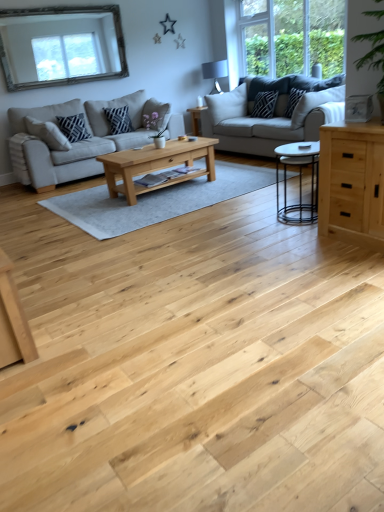
The height and width of the screenshot is (512, 384). I want to click on light gray fabric couch at left, marked as the first studio couch in a left-to-right arrangement, so click(80, 141).

The image size is (384, 512). What do you see at coordinates (80, 141) in the screenshot? I see `light gray fabric couch at left, the second studio couch when ordered from right to left` at bounding box center [80, 141].

This screenshot has width=384, height=512. What do you see at coordinates (61, 46) in the screenshot?
I see `silver-framed mirror at upper left` at bounding box center [61, 46].

Locate an element on the screen. The height and width of the screenshot is (512, 384). silver-framed mirror at upper left is located at coordinates (61, 46).

What is the approximate height of light gray fabric couch at center, which appears as the second studio couch when viewed from the left?

38.28 inches.

At what (x,y) coordinates should I click in order to perform the action: click on black metal coffee table at center, which is the first coffee table from front to back. Please return your answer as a coordinate pair (x, y). Looking at the image, I should click on (300, 181).

Describe the element at coordinates (352, 182) in the screenshot. This screenshot has width=384, height=512. I see `natural wood chest of drawers at right` at that location.

The width and height of the screenshot is (384, 512). Describe the element at coordinates (118, 120) in the screenshot. I see `matte black pillow at center-left, which ranks as the second pillow in left-to-right order` at that location.

This screenshot has height=512, width=384. What are the coordinates of `light gray fabric couch at left, the second studio couch when ordered from right to left` in the screenshot? It's located at (80, 141).

Based on the photo, how many degrees apart are the facing directions of matte black lampshade at upper center and white textured pillow at upper right, which appears as the first pillow when viewed from the right?

matte black lampshade at upper center and white textured pillow at upper right, which appears as the first pillow when viewed from the right, are facing 43 degrees away from each other.

Measure the distance between matte black lampshade at upper center and white textured pillow at upper right, which appears as the first pillow when viewed from the right.

matte black lampshade at upper center and white textured pillow at upper right, which appears as the first pillow when viewed from the right, are 1.81 meters apart.

Can we say matte black lampshade at upper center lies outside white textured pillow at upper right, which appears as the first pillow when viewed from the right?

Yes, matte black lampshade at upper center is outside of white textured pillow at upper right, which appears as the first pillow when viewed from the right.

Which of these two, matte black lampshade at upper center or white textured pillow at upper right, marked as the fourth pillow in a left-to-right arrangement, stands taller?

matte black lampshade at upper center is taller.

Is silver-framed mirror at upper left not close to light gray fabric couch at left, marked as the first studio couch in a left-to-right arrangement?

silver-framed mirror at upper left is actually quite close to light gray fabric couch at left, marked as the first studio couch in a left-to-right arrangement.

From the image's perspective, is silver-framed mirror at upper left beneath light gray fabric couch at left, the second studio couch when ordered from right to left?

Incorrect, from the image's perspective, silver-framed mirror at upper left is higher than light gray fabric couch at left, the second studio couch when ordered from right to left.

From a real-world perspective, is silver-framed mirror at upper left physically located above or below light gray fabric couch at left, marked as the first studio couch in a left-to-right arrangement?

silver-framed mirror at upper left is above light gray fabric couch at left, marked as the first studio couch in a left-to-right arrangement.

Can you confirm if silver-framed mirror at upper left is taller than light gray fabric couch at left, marked as the first studio couch in a left-to-right arrangement?

No, silver-framed mirror at upper left is not taller than light gray fabric couch at left, marked as the first studio couch in a left-to-right arrangement.

Is clear glass window at upper right not near white textured pillow at upper right, marked as the fourth pillow in a left-to-right arrangement?

Absolutely, clear glass window at upper right is distant from white textured pillow at upper right, marked as the fourth pillow in a left-to-right arrangement.

Is point (246, 64) positioned in front of point (291, 108)?

That is False.

Can you confirm if clear glass window at upper right is taller than white textured pillow at upper right, marked as the fourth pillow in a left-to-right arrangement?

Correct, clear glass window at upper right is much taller as white textured pillow at upper right, marked as the fourth pillow in a left-to-right arrangement.

Would you say clear glass window at upper right is inside or outside white textured pillow at upper right, marked as the fourth pillow in a left-to-right arrangement?

The correct answer is: outside.

Is clear glass window at upper right positioned far away from silver-framed mirror at upper left?

Yes, clear glass window at upper right and silver-framed mirror at upper left are located far from each other.

Which object is further away from the camera taking this photo, clear glass window at upper right or silver-framed mirror at upper left?

silver-framed mirror at upper left is further away from the camera.

Based on the photo, from the image's perspective, who appears lower, clear glass window at upper right or silver-framed mirror at upper left?

silver-framed mirror at upper left.

Looking at this image, between clear glass window at upper right and silver-framed mirror at upper left, which one appears on the right side from the viewer's perspective?

clear glass window at upper right.

In the scene shown: Which of these two, black metal coffee table at center, the 1th coffee table in the right-to-left sequence, or clear glass window at upper right, is thinner?

clear glass window at upper right is thinner.

Which is more to the left, black metal coffee table at center, the 1th coffee table in the right-to-left sequence, or clear glass window at upper right?

black metal coffee table at center, the 1th coffee table in the right-to-left sequence.

From a real-world perspective, between black metal coffee table at center, which is the first coffee table from front to back, and clear glass window at upper right, who is vertically lower?

black metal coffee table at center, which is the first coffee table from front to back.

From a real-world perspective, does clear glass window at upper right sit lower than matte black pillow at left, positioned as the 4th pillow in right-to-left order?

Incorrect, from a real-world perspective, clear glass window at upper right is higher than matte black pillow at left, positioned as the 4th pillow in right-to-left order.

Considering the sizes of objects clear glass window at upper right and matte black pillow at left, positioned as the 4th pillow in right-to-left order, in the image provided, who is wider, clear glass window at upper right or matte black pillow at left, positioned as the 4th pillow in right-to-left order,?

Wider between the two is matte black pillow at left, positioned as the 4th pillow in right-to-left order.

Is clear glass window at upper right situated inside matte black pillow at left, arranged as the first pillow when viewed from the left, or outside?

clear glass window at upper right is not inside matte black pillow at left, arranged as the first pillow when viewed from the left, it's outside.

Is there a large distance between natural wood chest of drawers at right and matte black lampshade at upper center?

natural wood chest of drawers at right is far away from matte black lampshade at upper center.

Does natural wood chest of drawers at right have a greater height compared to matte black lampshade at upper center?

Indeed, natural wood chest of drawers at right has a greater height compared to matte black lampshade at upper center.

Would you say natural wood chest of drawers at right contains matte black lampshade at upper center?

No, matte black lampshade at upper center is not a part of natural wood chest of drawers at right.

Consider the image. Considering the sizes of objects natural wood chest of drawers at right and matte black lampshade at upper center in the image provided, who is thinner, natural wood chest of drawers at right or matte black lampshade at upper center?

natural wood chest of drawers at right.

Locate an element on the screen. The image size is (384, 512). lamp above the white textured pillow at upper right, which appears as the first pillow when viewed from the right (from a real-world perspective) is located at coordinates (215, 73).

The width and height of the screenshot is (384, 512). Find the location of `mirror that is above the light gray fabric couch at left, marked as the first studio couch in a left-to-right arrangement (from the image's perspective)`. mirror that is above the light gray fabric couch at left, marked as the first studio couch in a left-to-right arrangement (from the image's perspective) is located at coordinates (61, 46).

When comparing their distances from light gray fabric couch at left, marked as the first studio couch in a left-to-right arrangement, does black textured pillow at upper right, which ranks as the 3th pillow in left-to-right order, or matte black lampshade at upper center seem further?

black textured pillow at upper right, which ranks as the 3th pillow in left-to-right order, is positioned further to the anchor light gray fabric couch at left, marked as the first studio couch in a left-to-right arrangement.

Based on their spatial positions, is light gray fabric couch at center, the 1th studio couch viewed from the right, or natural wood coffee table at center, which appears as the first coffee table when viewed from the left, closer to natural wood chest of drawers at right?

Among the two, natural wood coffee table at center, which appears as the first coffee table when viewed from the left, is located nearer to natural wood chest of drawers at right.

When comparing their distances from light gray fabric couch at left, the second studio couch when ordered from right to left, does matte black pillow at left, arranged as the first pillow when viewed from the left, or matte black lampshade at upper center seem closer?

matte black pillow at left, arranged as the first pillow when viewed from the left, is closer to light gray fabric couch at left, the second studio couch when ordered from right to left.

Looking at this image, looking at the image, which one is located further to black metal coffee table at center, the 1th coffee table in the right-to-left sequence, matte black lampshade at upper center or clear glass window at upper right?

Based on the image, matte black lampshade at upper center appears to be further to black metal coffee table at center, the 1th coffee table in the right-to-left sequence.

Looking at the image, which one is located closer to clear glass window at upper right, matte black pillow at left, positioned as the 4th pillow in right-to-left order, or natural wood coffee table at center, positioned as the second coffee table in front-to-back order?

natural wood coffee table at center, positioned as the second coffee table in front-to-back order.

Looking at the image, which one is located further to black metal coffee table at center, which is the first coffee table from front to back, black textured pillow at upper right, the second pillow positioned from the right, or clear glass window at upper right?

The object further to black metal coffee table at center, which is the first coffee table from front to back, is clear glass window at upper right.

Looking at the image, which one is located closer to light gray fabric couch at left, marked as the first studio couch in a left-to-right arrangement, natural wood coffee table at center, which appears as the first coffee table when viewed from the left, or clear glass window at upper right?

natural wood coffee table at center, which appears as the first coffee table when viewed from the left, is positioned closer to the anchor light gray fabric couch at left, marked as the first studio couch in a left-to-right arrangement.

Based on their spatial positions, is black metal coffee table at center, which is the first coffee table from front to back, or light gray fabric couch at center, which appears as the second studio couch when viewed from the left, further from light gray fabric couch at left, marked as the first studio couch in a left-to-right arrangement?

Among the two, black metal coffee table at center, which is the first coffee table from front to back, is located further to light gray fabric couch at left, marked as the first studio couch in a left-to-right arrangement.

Where is `studio couch between matte black pillow at center-left, which ranks as the second pillow in left-to-right order, and clear glass window at upper right from left to right`? studio couch between matte black pillow at center-left, which ranks as the second pillow in left-to-right order, and clear glass window at upper right from left to right is located at coordinates (263, 120).

Find the location of a particular element. coffee table located between matte black pillow at left, arranged as the first pillow when viewed from the left, and black metal coffee table at center, which is the first coffee table from front to back, in the left-right direction is located at coordinates (156, 165).

Where is `mirror between natural wood chest of drawers at right and matte black pillow at left, arranged as the first pillow when viewed from the left, along the z-axis`? This screenshot has height=512, width=384. mirror between natural wood chest of drawers at right and matte black pillow at left, arranged as the first pillow when viewed from the left, along the z-axis is located at coordinates (61, 46).

Locate an element on the screen. The image size is (384, 512). lamp situated between light gray fabric couch at left, the second studio couch when ordered from right to left, and light gray fabric couch at center, the 1th studio couch viewed from the right, from left to right is located at coordinates (215, 73).